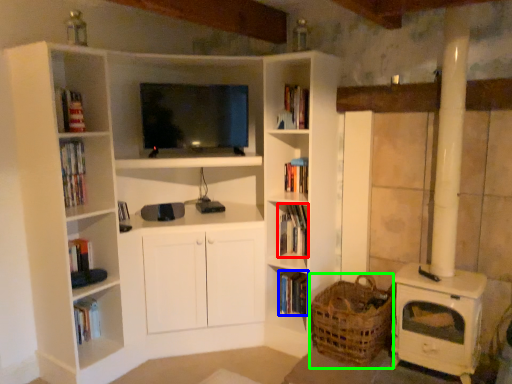
Question: Which object is the closest to the book (highlighted by a red box)? Choose among these: book (highlighted by a blue box) or basket (highlighted by a green box).

Choices:
 (A) book
 (B) basket

Answer: (A)